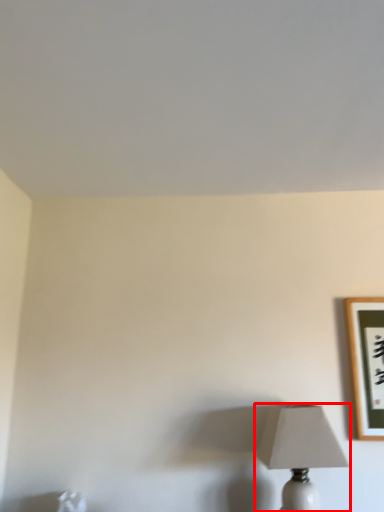
Question: Observing the image, what is the correct spatial positioning of lamp (annotated by the red box) in reference to picture frame?

Choices:
 (A) left
 (B) right

Answer: (A)